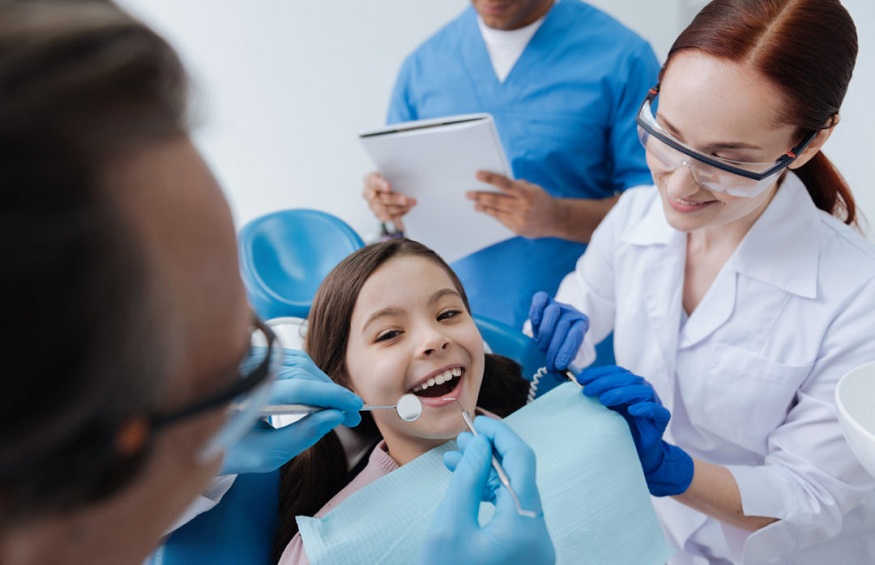
This screenshot has height=565, width=875. I want to click on wall, so click(247, 47).